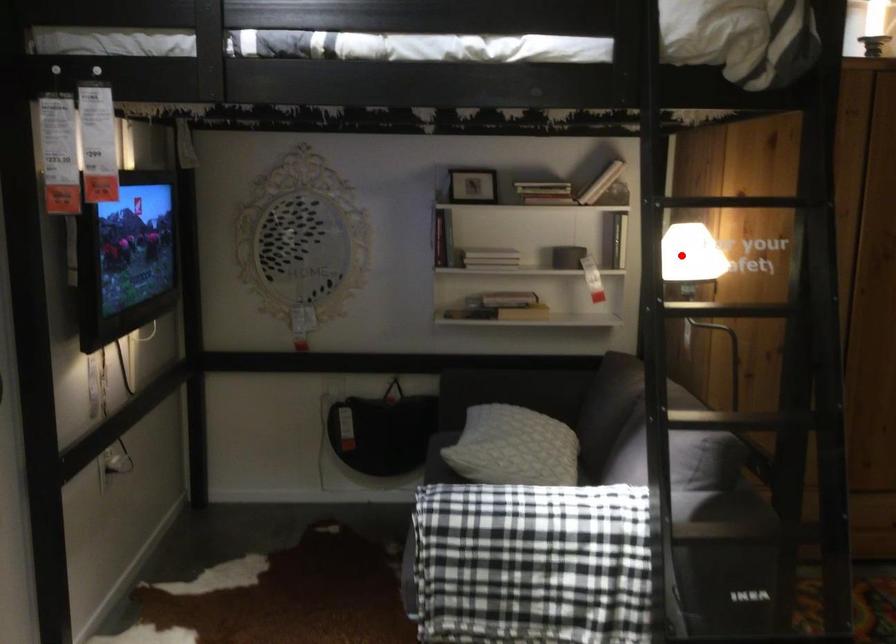
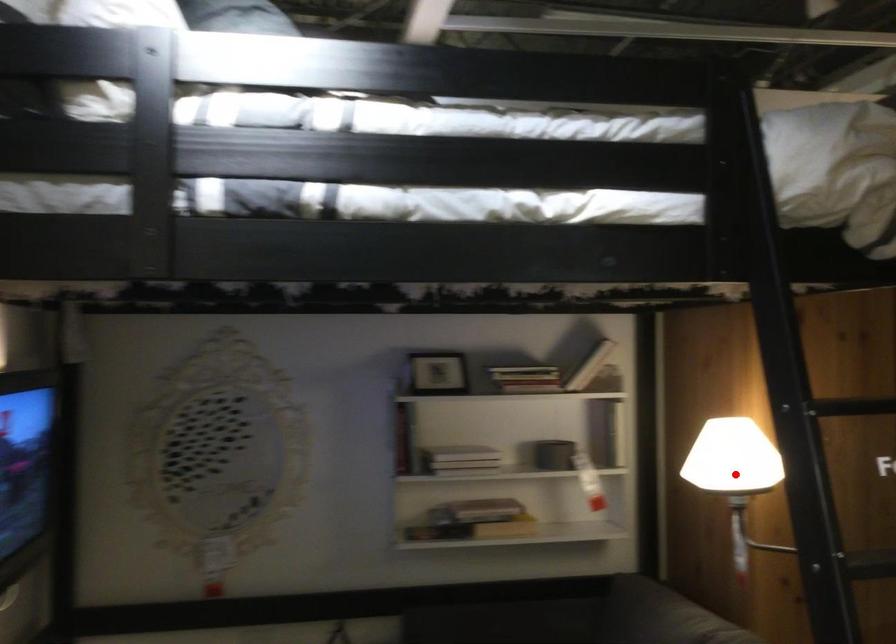
I am providing you with two images of the same scene from different viewpoints. A red point is marked on the first image and another point is marked on the second image. Are the points marked in image1 and image2 representing the same 3D position?

Yes